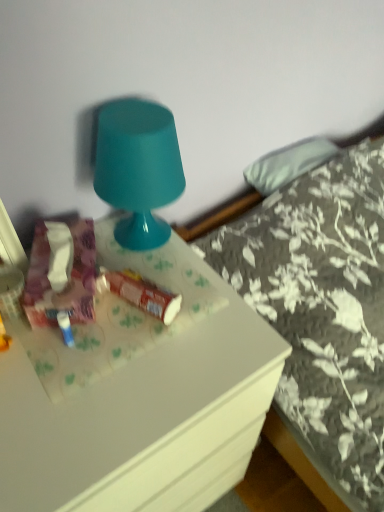
The width and height of the screenshot is (384, 512). I want to click on free location to the left of matte plastic tube at center, arranged as the first stuff when viewed from the right, so click(x=74, y=326).